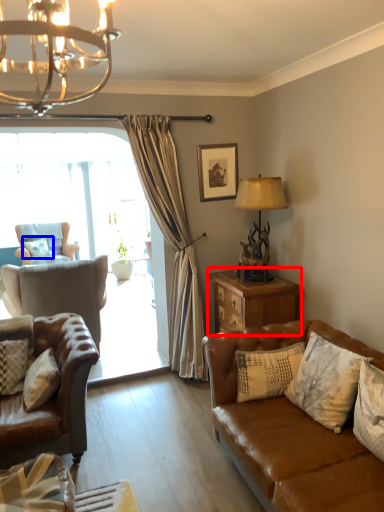
Question: Among these objects, which one is nearest to the camera, nightstand (highlighted by a red box) or pillow (highlighted by a blue box)?

Choices:
 (A) nightstand
 (B) pillow

Answer: (A)